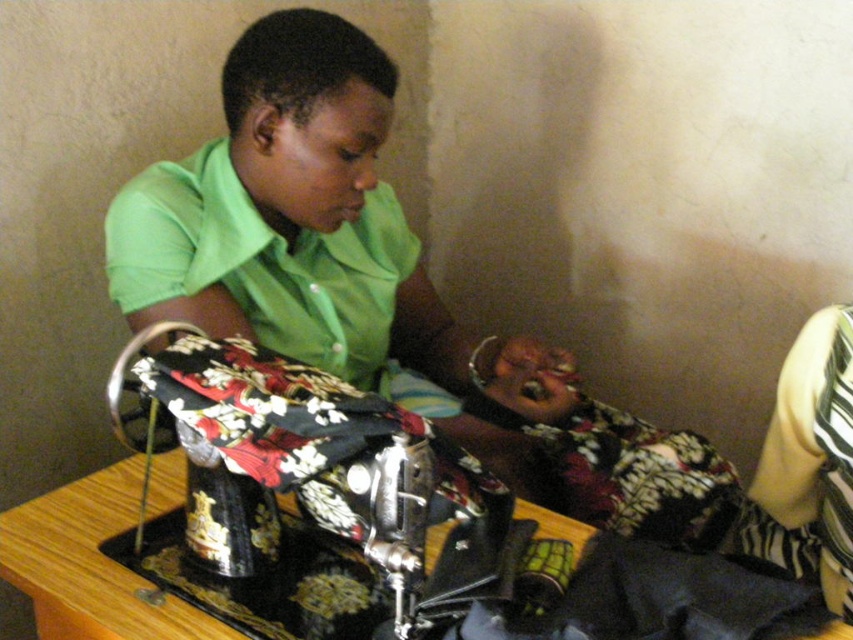
Is point (228, 211) less distant than point (814, 474)?

Yes, it is in front of point (814, 474).

Identify the location of floral cotton fabric at center. (262, 262).

Which is more to the left, black fabric-covered sewing machine at center or yellow striped fabric at right?

Positioned to the left is black fabric-covered sewing machine at center.

Identify the location of black fabric-covered sewing machine at center. (318, 470).

The image size is (853, 640). In order to click on black fabric-covered sewing machine at center in this screenshot , I will do `click(318, 470)`.

Identify the location of black fabric-covered sewing machine at center. (318, 470).

Consider the image. Does black fabric-covered sewing machine at center have a larger size compared to floral cotton fabric at center?

No, black fabric-covered sewing machine at center is not bigger than floral cotton fabric at center.

Is black fabric-covered sewing machine at center thinner than floral cotton fabric at center?

Indeed, black fabric-covered sewing machine at center has a lesser width compared to floral cotton fabric at center.

Does point (467, 598) come farther from viewer compared to point (177, 184)?

No, (467, 598) is in front of (177, 184).

Where is `black fabric-covered sewing machine at center`? black fabric-covered sewing machine at center is located at coordinates (318, 470).